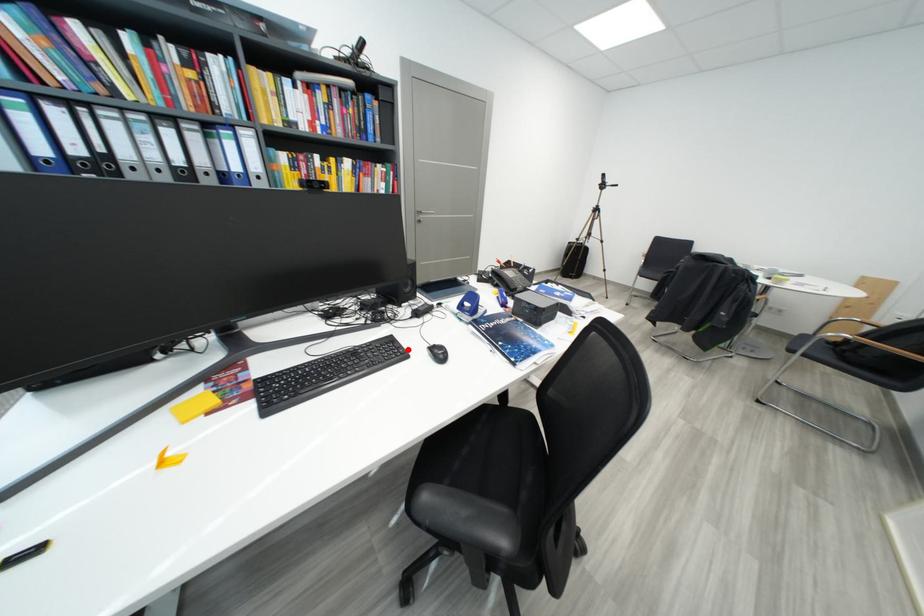
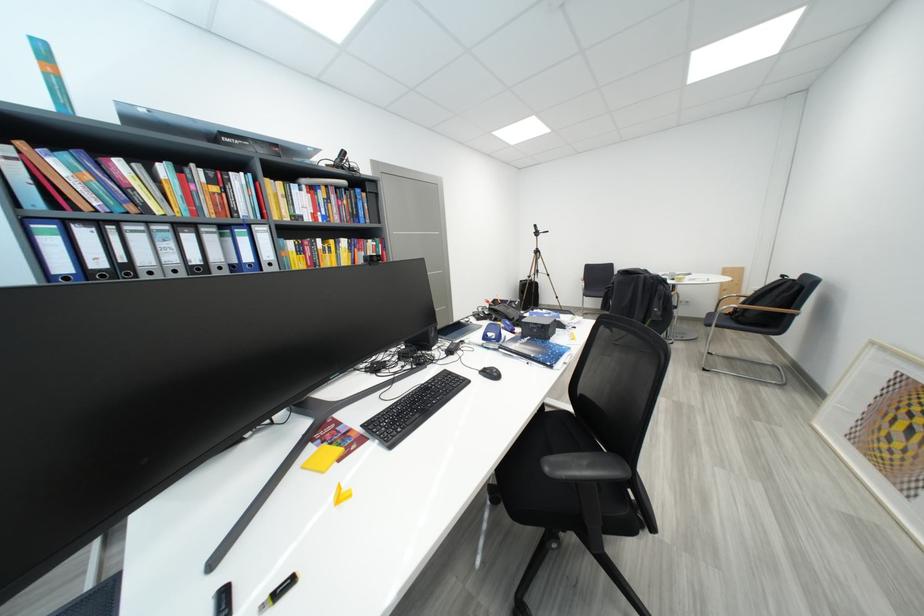
The point at the highlighted location is marked in the first image. Where is the corresponding point in the second image?

(467, 379)